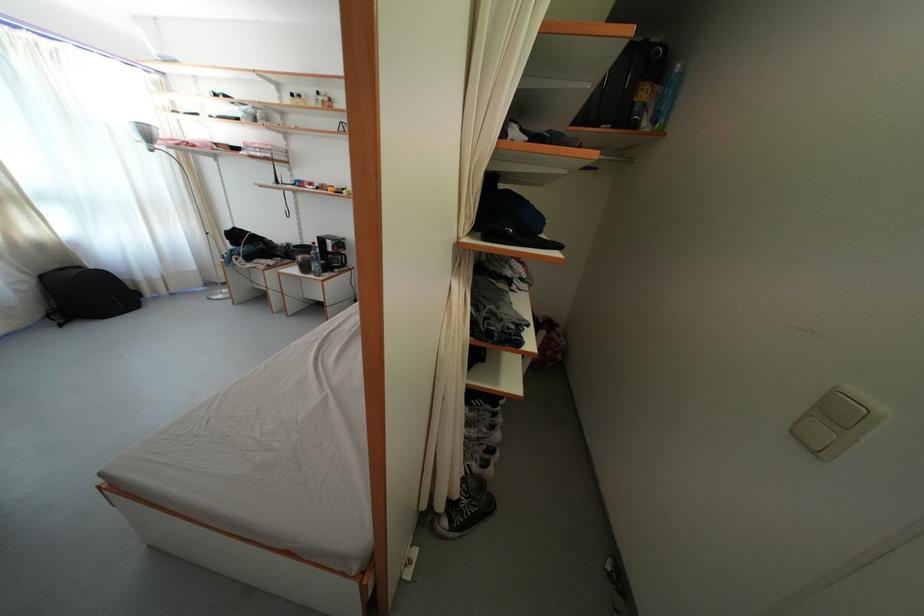
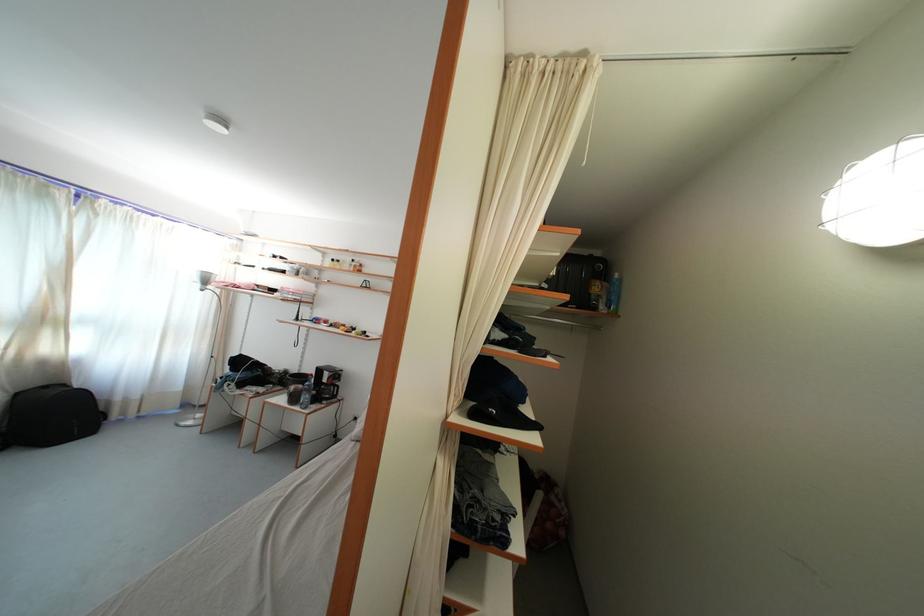
Question: Based on the continuous images, in which direction is the camera rotating? Reply with the corresponding letter.

Choices:
 (A) Left
 (B) Right
 (C) Up
 (D) Down

Answer: (C)